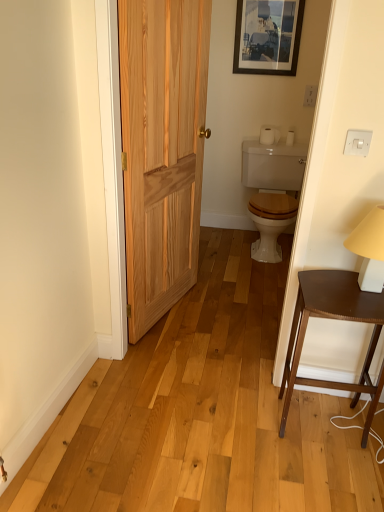
Identify the location of unoccupied area in front of natural wood door at left. (187, 337).